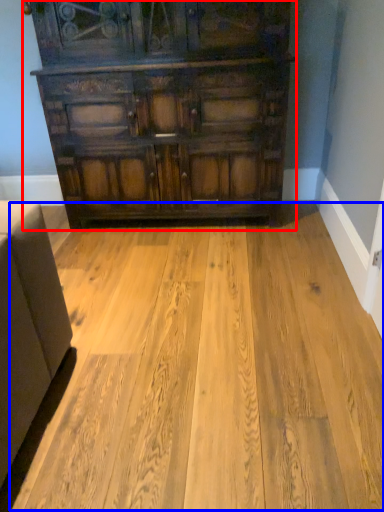
Question: Which point is closer to the camera, chest of drawers (highlighted by a red box) or plywood (highlighted by a blue box)?

Choices:
 (A) chest of drawers
 (B) plywood

Answer: (B)